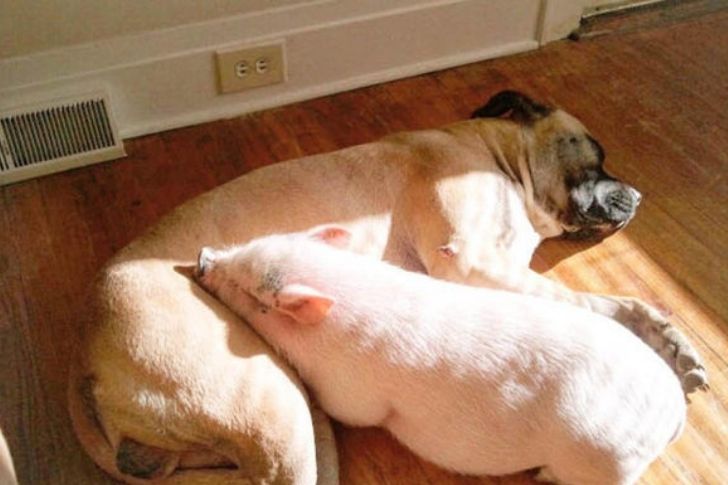
You are a GUI agent. You are given a task and a screenshot of the screen. Output one action in this format:
    pyautogui.click(x=<x>, y=<y>)
    Task: Click on the wall
    The width and height of the screenshot is (728, 485).
    Given the screenshot: What is the action you would take?
    pyautogui.click(x=135, y=14)